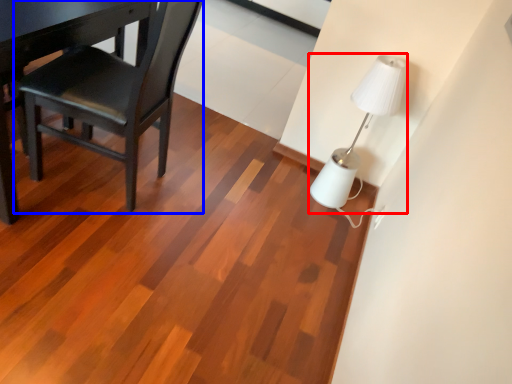
Question: Among these objects, which one is nearest to the camera, lamp (highlighted by a red box) or chair (highlighted by a blue box)?

Choices:
 (A) lamp
 (B) chair

Answer: (B)